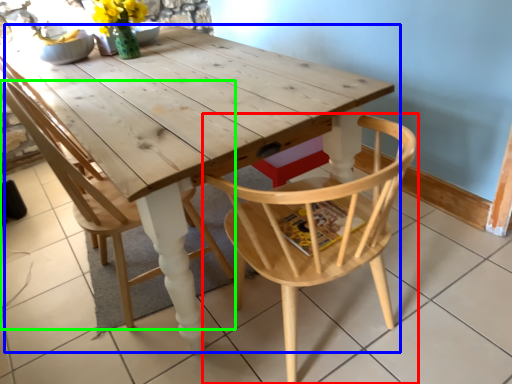
Question: Considering the real-world distances, which object is closest to chair (highlighted by a red box)? table (highlighted by a blue box) or chair (highlighted by a green box).

Choices:
 (A) table
 (B) chair

Answer: (A)